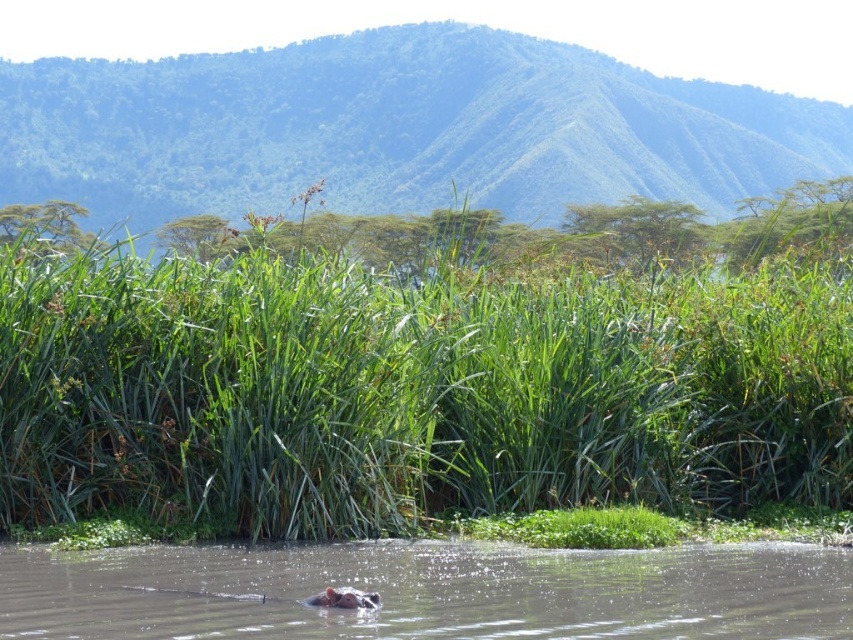
You are a small boat operator navigating through the brown muddy water at lower center. You notice the green matte hippo at lower center ahead. Can you safely pass through the area between them without hitting the hippo?

The brown muddy water at lower center is smaller than the green matte hippo at lower center, so there might not be enough space to safely pass between them. You should avoid the area to prevent collision with the hippo.